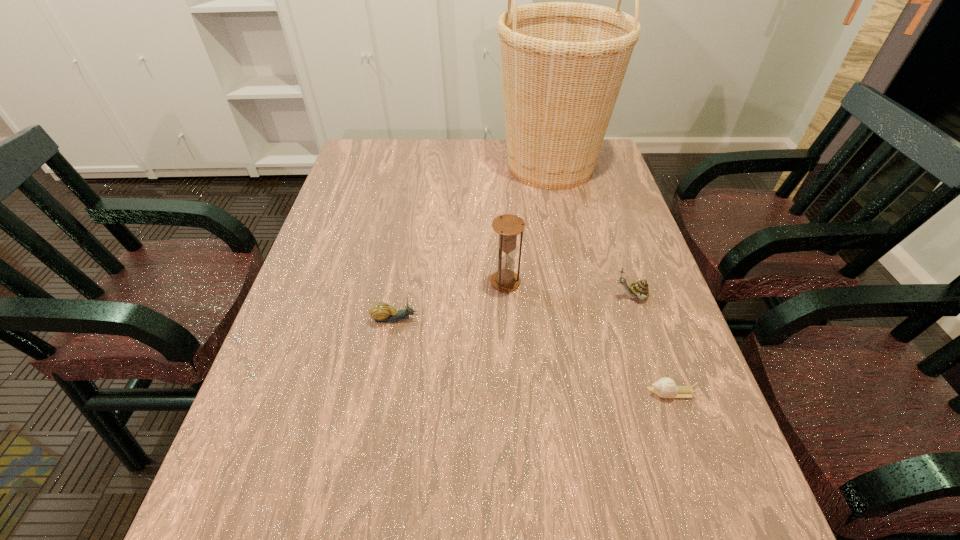
At what (x,y) coordinates should I click in order to perform the action: click on the farthest object. Please return your answer as a coordinate pair (x, y). This screenshot has width=960, height=540. Looking at the image, I should click on coord(563,63).

At what (x,y) coordinates should I click in order to perform the action: click on the tallest object. Please return your answer as a coordinate pair (x, y). Looking at the image, I should click on (563, 63).

Locate an element on the screen. The width and height of the screenshot is (960, 540). the second tallest object is located at coordinates (508, 226).

You are a GUI agent. You are given a task and a screenshot of the screen. Output one action in this format:
    pyautogui.click(x=<x>, y=<y>)
    Task: Click on the farthest escargot
    Image resolution: width=960 pixels, height=540 pixels.
    Given the screenshot: What is the action you would take?
    pyautogui.click(x=639, y=289)

At what (x,y) coordinates should I click in order to perform the action: click on the tallest escargot. Please return your answer as a coordinate pair (x, y). This screenshot has width=960, height=540. Looking at the image, I should click on (639, 289).

Find the location of a particular element. the fourth tallest object is located at coordinates (381, 312).

The height and width of the screenshot is (540, 960). I want to click on the fourth farthest object, so click(x=381, y=312).

Find the location of `the shortest escargot`. the shortest escargot is located at coordinates (665, 387).

I want to click on the nearest object, so click(x=665, y=387).

Find the location of a particular element. blank area located 0.100m on the front of the basket is located at coordinates (562, 220).